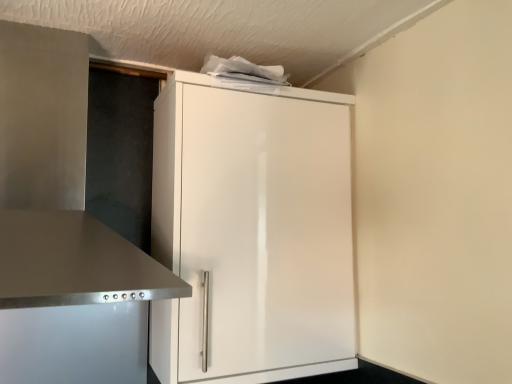
In order to click on free space above stainless steel vent at left (from a real-world perspective) in this screenshot , I will do `click(91, 33)`.